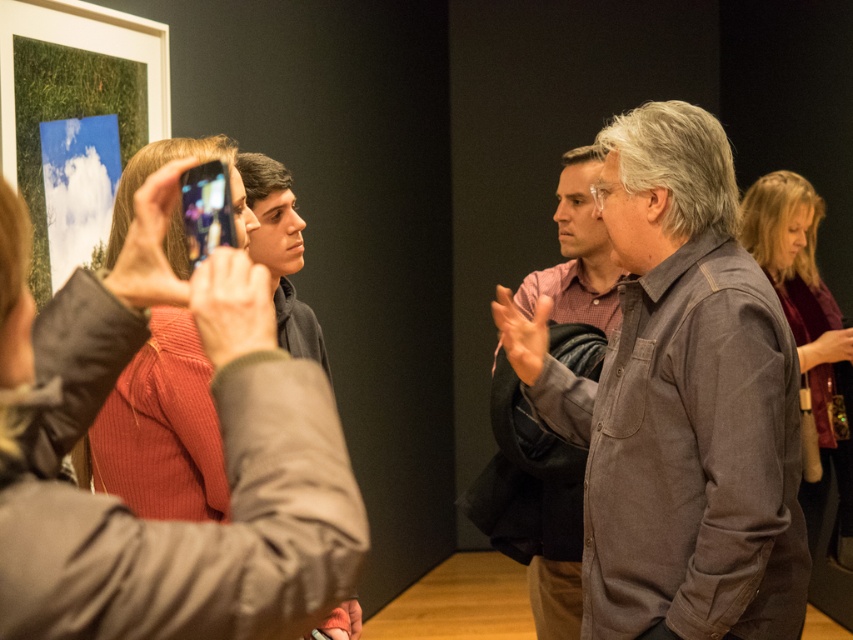
Question: From the image, what is the correct spatial relationship of brown cotton shirt at center in relation to maroon velvet blouse at right?

Choices:
 (A) below
 (B) above

Answer: (B)

Question: Which of the following is the closest to the observer?

Choices:
 (A) (111, 228)
 (B) (822, 456)
 (C) (721, 243)
 (D) (554, 625)

Answer: (A)

Question: Among these points, which one is farthest from the camera?

Choices:
 (A) (784, 180)
 (B) (556, 483)
 (C) (115, 445)
 (D) (708, 380)

Answer: (A)

Question: Can you confirm if brown cotton shirt at center is bigger than denim shirt at center?

Choices:
 (A) no
 (B) yes

Answer: (A)

Question: Can you confirm if brown cotton shirt at center is positioned above ribbed sweater at center?

Choices:
 (A) yes
 (B) no

Answer: (B)

Question: Among these points, which one is nearest to the camera?

Choices:
 (A) (231, 161)
 (B) (781, 260)
 (C) (567, 314)

Answer: (A)